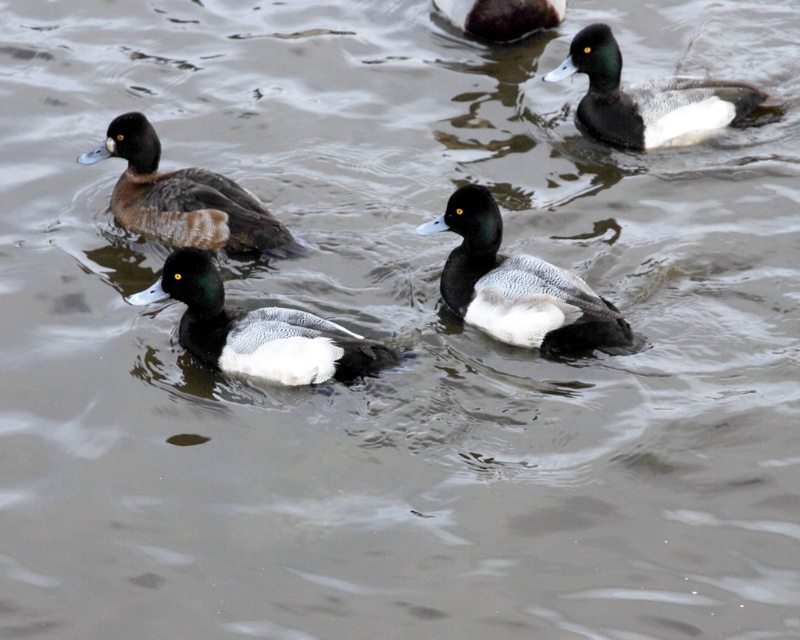
Question: Which object appears closest to the camera in this image?

Choices:
 (A) black matte duck at center
 (B) matte black duck at center
 (C) black matte duck at upper center

Answer: (B)

Question: Estimate the real-world distances between objects in this image. Which object is closer to the black matte duck at upper center?

Choices:
 (A) matte black duck at left
 (B) matte black duck at upper right

Answer: (B)

Question: Does black matte duck at center have a smaller size compared to matte black duck at center?

Choices:
 (A) no
 (B) yes

Answer: (A)

Question: In this image, where is black matte duck at center located relative to black matte duck at upper center?

Choices:
 (A) above
 (B) below

Answer: (B)

Question: Does black matte duck at center have a smaller size compared to matte black duck at left?

Choices:
 (A) no
 (B) yes

Answer: (A)

Question: Among these objects, which one is farthest from the camera?

Choices:
 (A) matte black duck at left
 (B) black matte duck at center
 (C) matte black duck at center
 (D) black matte duck at upper center

Answer: (D)